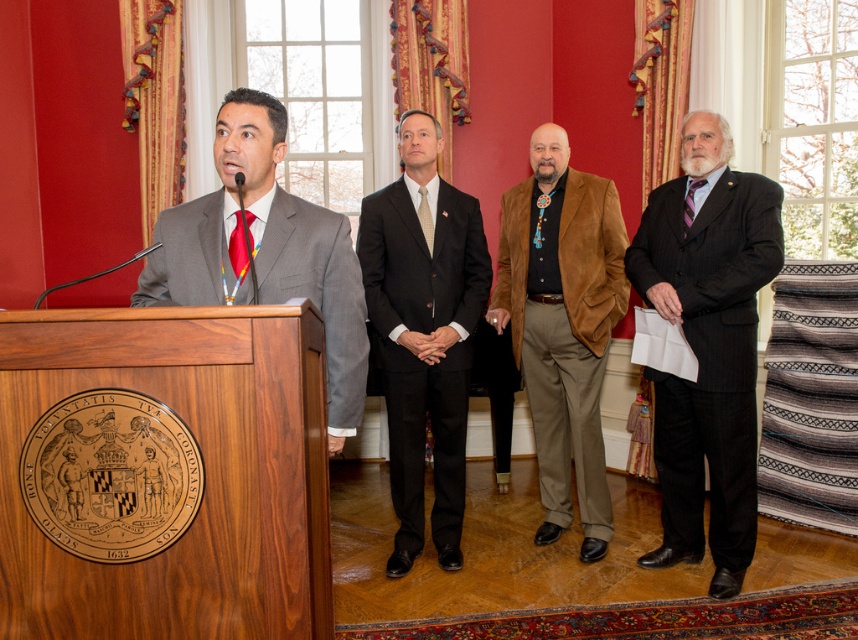
Does suede jacket at center appear under light brown textured tie at center?

Yes, suede jacket at center is below light brown textured tie at center.

Based on the photo, can you confirm if suede jacket at center is taller than light brown textured tie at center?

Indeed, suede jacket at center has a greater height compared to light brown textured tie at center.

Who is more distant from viewer, (573, 241) or (426, 209)?

The point (573, 241) is more distant.

Identify the location of suede jacket at center. This screenshot has height=640, width=858. (562, 324).

Is suede jacket at center smaller than matte gray suit at left?

Actually, suede jacket at center might be larger than matte gray suit at left.

Which of these two, suede jacket at center or matte gray suit at left, stands taller?

Standing taller between the two is suede jacket at center.

Measure the distance between point (x=535, y=288) and camera.

Point (x=535, y=288) is 3.30 meters from camera.

Where is `suede jacket at center`? This screenshot has width=858, height=640. suede jacket at center is located at coordinates (562, 324).

Who is taller, dark gray pinstripe suit at right or light brown textured tie at center?

dark gray pinstripe suit at right

Can you confirm if dark gray pinstripe suit at right is wider than light brown textured tie at center?

Indeed, dark gray pinstripe suit at right has a greater width compared to light brown textured tie at center.

Who is more forward, [735,500] or [426,232]?

Point [735,500]

Identify the location of dark gray pinstripe suit at right. This screenshot has height=640, width=858. (707, 346).